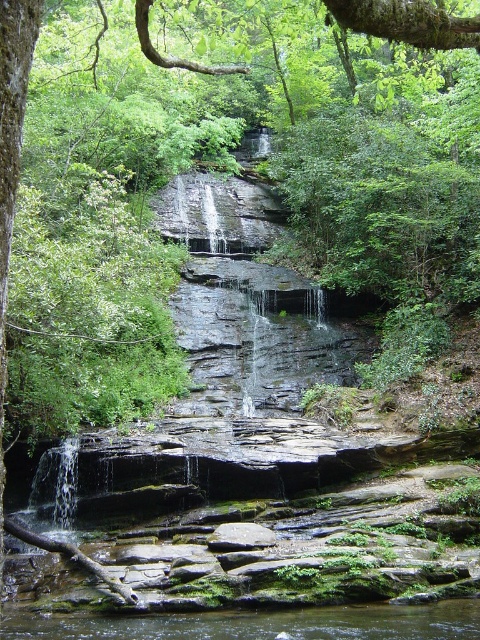
Question: Among these points, which one is nearest to the camera?

Choices:
 (A) (236, 545)
 (B) (304, 627)

Answer: (B)

Question: Which object appears farthest from the camera in this image?

Choices:
 (A) gray smooth rock at center
 (B) clear water at center

Answer: (A)

Question: Can you confirm if clear water at center is positioned to the left of gray smooth rock at center?

Choices:
 (A) no
 (B) yes

Answer: (B)

Question: Can you confirm if clear water at center is positioned above gray smooth rock at center?

Choices:
 (A) no
 (B) yes

Answer: (A)

Question: Among these points, which one is nearest to the camera?

Choices:
 (A) (261, 529)
 (B) (145, 628)

Answer: (B)

Question: Does clear water at center appear on the left side of gray smooth rock at center?

Choices:
 (A) no
 (B) yes

Answer: (B)